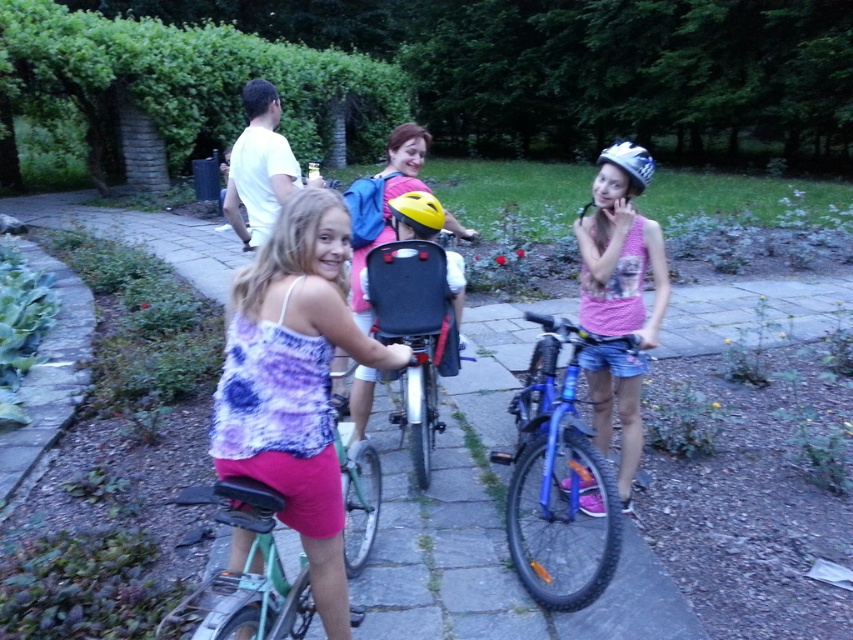
Can you confirm if blue metallic bicycle at center is positioned above pink fabric shirt at center?

Incorrect, blue metallic bicycle at center is not positioned above pink fabric shirt at center.

Which is above, blue metallic bicycle at center or pink fabric shirt at center?

pink fabric shirt at center

Find the location of a particular element. blue metallic bicycle at center is located at coordinates point(556,481).

Does matte purple tank top at center appear under pink fabric shirt at center?

Correct, matte purple tank top at center is located below pink fabric shirt at center.

Does point (328, 301) lie behind point (622, 433)?

No.

Where is `matte purple tank top at center`? The image size is (853, 640). matte purple tank top at center is located at coordinates (294, 381).

Does green stone pavement at center appear on the left side of pink fabric shirt at center?

Yes, green stone pavement at center is to the left of pink fabric shirt at center.

This screenshot has height=640, width=853. In order to click on green stone pavement at center in this screenshot , I will do `click(485, 560)`.